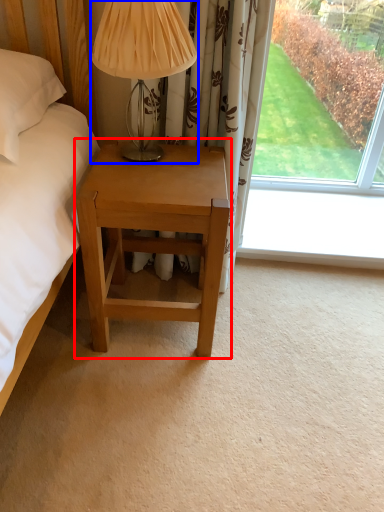
Question: Which object appears closest to the camera in this image, nightstand (highlighted by a red box) or table lamp (highlighted by a blue box)?

Choices:
 (A) nightstand
 (B) table lamp

Answer: (B)